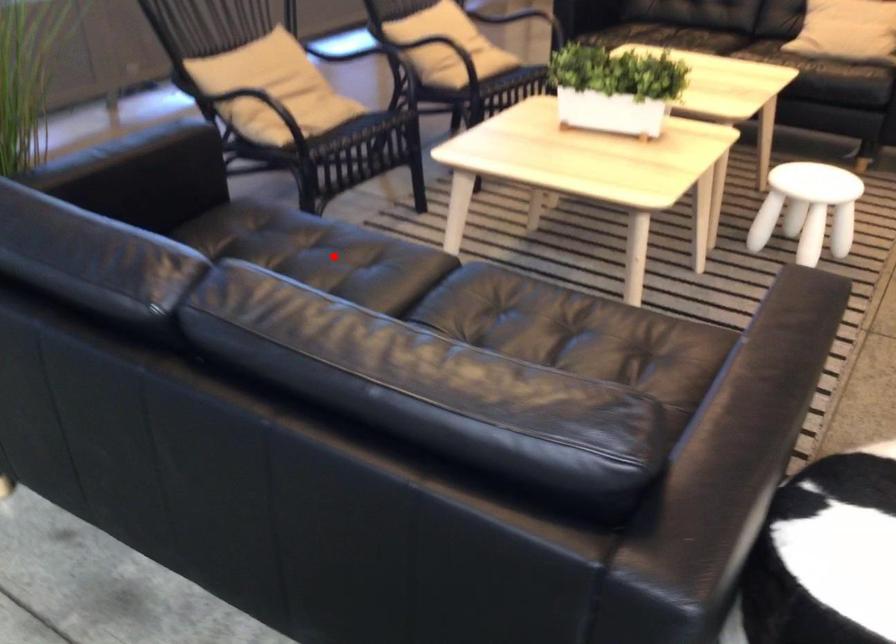
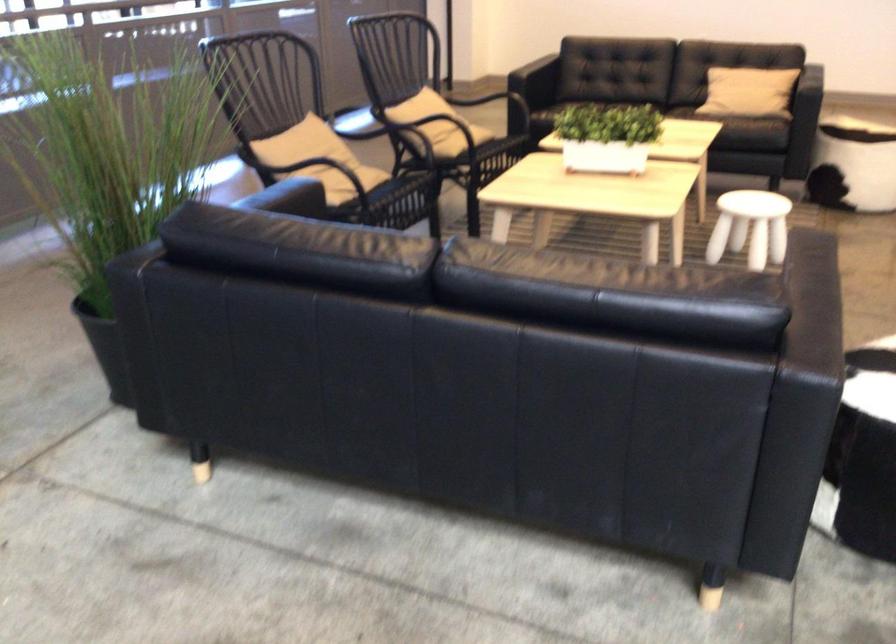
Question: I am providing you with two images of the same scene from different viewpoints. A red point is marked on the first image. Is the red point's position out of view in image 2?

Choices:
 (A) Yes
 (B) No

Answer: (A)